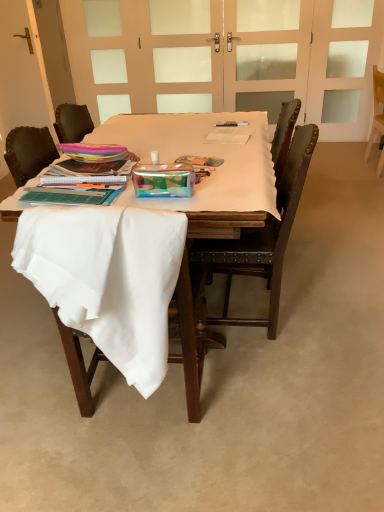
Question: Choose the correct answer: Is white matte door at upper center inside white frosted glass screen door at upper right, placed as the first screen door when sorted from right to left, or outside it?

Choices:
 (A) outside
 (B) inside

Answer: (A)

Question: Is white matte door at upper center bigger or smaller than white frosted glass screen door at upper right, placed as the first screen door when sorted from right to left?

Choices:
 (A) big
 (B) small

Answer: (B)

Question: Estimate the real-world distances between objects in this image. Which object is closer to the white fabric-covered table at center?

Choices:
 (A) white fabric chair at lower left, which is the third chair from right to left
 (B) white fabric-covered desk at center
 (C) metallic silver pen at center
 (D) brown leather chair at center, placed as the second chair when sorted from back to front
 (E) white matte door at upper center

Answer: (B)

Question: Estimate the real-world distances between objects in this image. Which object is farther from the white matte screen door at upper center, which appears as the first screen door when viewed from the left?

Choices:
 (A) white frosted glass screen door at upper right, the 3th screen door in the left-to-right sequence
 (B) white fabric-covered table at center
 (C) white fabric chair at lower left, which is counted as the first chair, starting from the front
 (D) white fabric-covered desk at center
 (E) transparent glass screen door at upper center, which ranks as the second screen door in right-to-left order

Answer: (C)